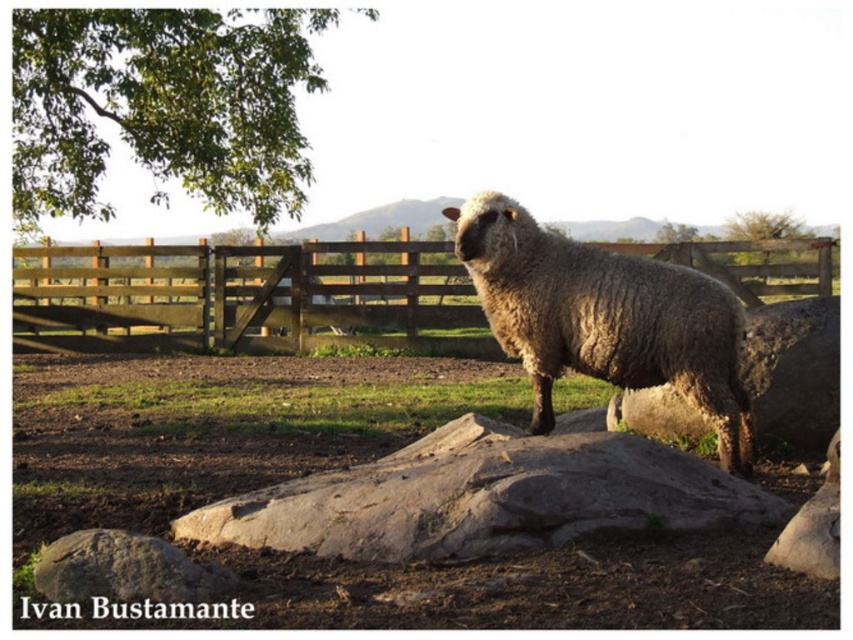
Question: Can you confirm if wooden gate at center is bigger than gray rough rock at center?

Choices:
 (A) no
 (B) yes

Answer: (B)

Question: Which object appears closest to the camera in this image?

Choices:
 (A) green leafy tree at upper left
 (B) wooden gate at center
 (C) fuzzy woolly sheep at center
 (D) gray rough rock at center

Answer: (D)

Question: Among these points, which one is nearest to the camera?

Choices:
 (A) (699, 301)
 (B) (59, 164)

Answer: (A)

Question: Can you confirm if green leafy tree at upper left is positioned to the left of wooden gate at center?

Choices:
 (A) yes
 (B) no

Answer: (A)

Question: In this image, where is green leafy tree at upper left located relative to wooden gate at center?

Choices:
 (A) above
 (B) below

Answer: (A)

Question: Which point is closer to the camera taking this photo?

Choices:
 (A) (183, 346)
 (B) (78, 163)

Answer: (B)